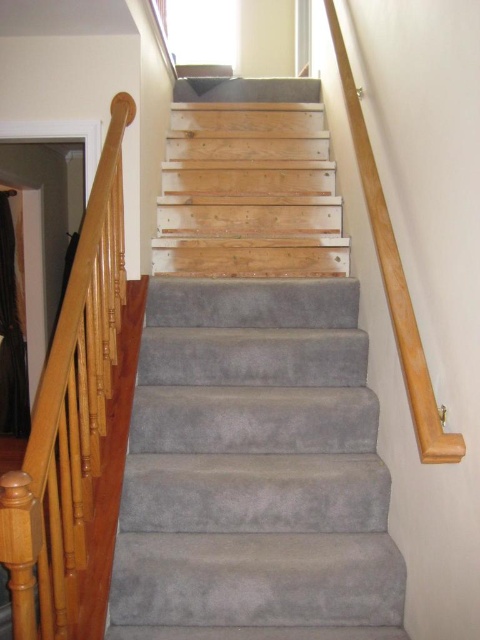
You are standing at the bottom of the staircase and want to reach the handrail for support. Since the gray carpeted stairs at center and wooden handrail at left are in your view, which one is located below the other?

The gray carpeted stairs at center is positioned under the wooden handrail at left, so the stairs are below the handrail.

You are standing at the bottom of the staircase and want to reach the top. There are two points marked on the staircase, point 1 at coordinates point [284,438] and point 2 at coordinates point [48,390]. Which point should you step on first to ascend the staircase?

You should step on point 2 at coordinates point [48,390] first because point 1 at coordinates point [284,438] is behind it, meaning point 2 is closer to the bottom of the staircase.